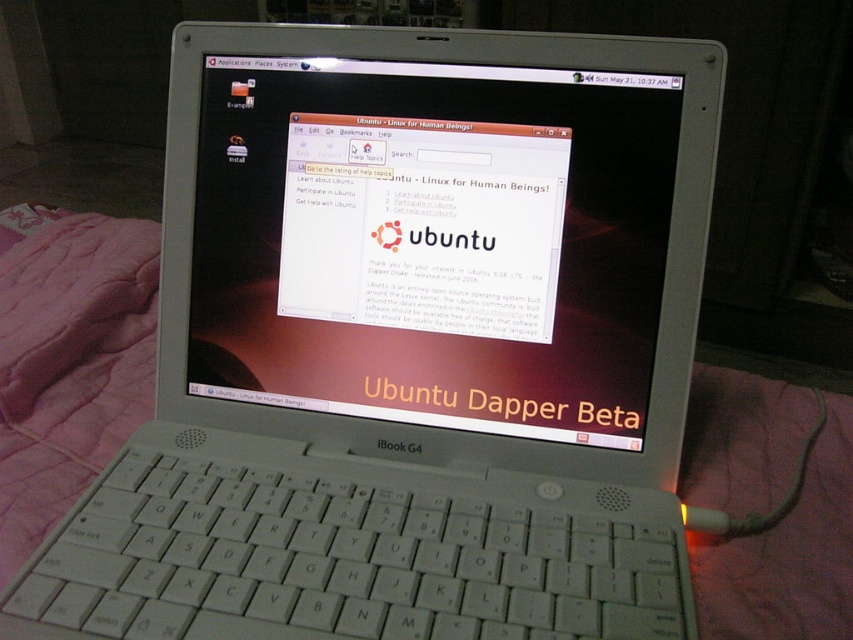
You are trying to take a photo of the white glossy laptop screen at center but notice the pink quilted blanket at left is in the way. Can you see the blanket in your camera viewfinder when focusing on the laptop screen?

The pink quilted blanket at left is behind the white glossy laptop screen at center, so when focusing on the laptop screen, the blanket would not be visible in the camera viewfinder as it is obscured by the laptop screen.

You are trying to place the pink quilted blanket at left on top of the white glossy laptop screen at center. Based on their sizes, is this possible?

The white glossy laptop screen at center might be wider than pink quilted blanket at left, so it is uncertain if the blanket will fit without overlapping or hanging off the edges.

Looking at this image, you are trying to decide where to place a new small plant on the desk. The desk has the white glossy laptop screen at center and the pink quilted blanket at left. Based on their sizes, which object should you place the plant next to to ensure it has enough space?

The pink quilted blanket at left occupies more space than the white glossy laptop screen at center, so you should place the plant next to the pink quilted blanket at left to ensure it has enough space.